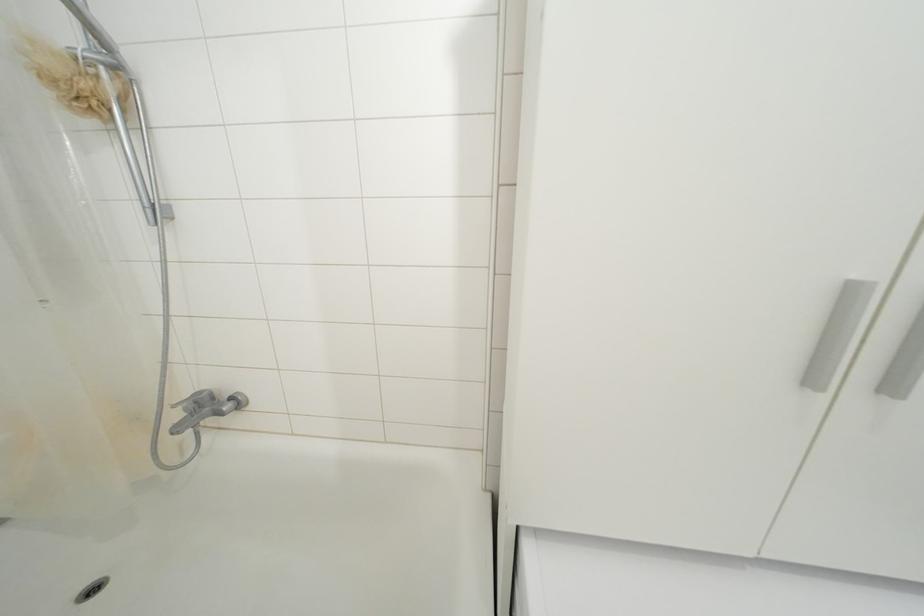
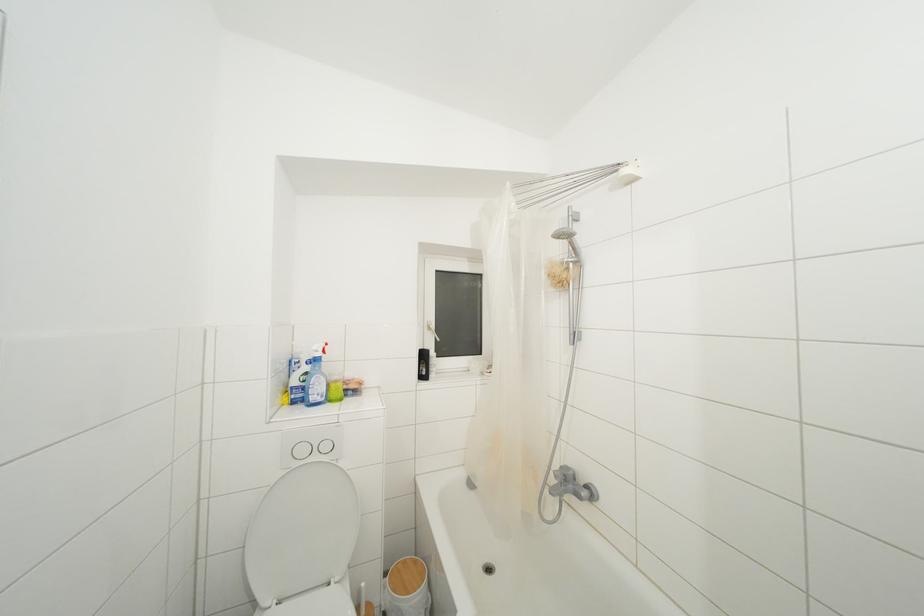
Where in the second image is the point corresponding to pixel 100 79 from the first image?

(572, 273)